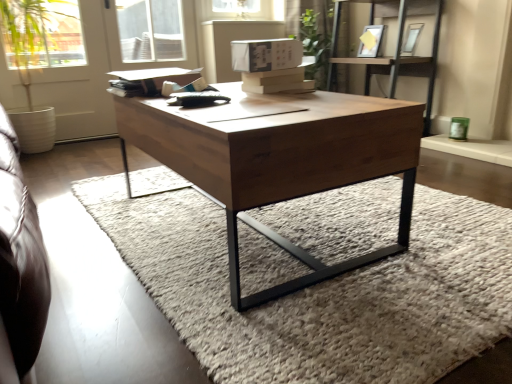
Question: From the image's perspective, is wooden shelf at upper right above matte white picture frame at upper center, arranged as the second picture frame when viewed from the right?

Choices:
 (A) no
 (B) yes

Answer: (A)

Question: Considering the relative sizes of wooden shelf at upper right and matte white picture frame at upper center, positioned as the 1th picture frame in left-to-right order, in the image provided, is wooden shelf at upper right taller than matte white picture frame at upper center, positioned as the 1th picture frame in left-to-right order,?

Choices:
 (A) no
 (B) yes

Answer: (B)

Question: From the image's perspective, is wooden shelf at upper right located beneath matte white picture frame at upper center, positioned as the 1th picture frame in left-to-right order?

Choices:
 (A) no
 (B) yes

Answer: (B)

Question: Is wooden shelf at upper right not within matte white picture frame at upper center, positioned as the 1th picture frame in left-to-right order?

Choices:
 (A) yes
 (B) no

Answer: (A)

Question: Would you say wooden shelf at upper right is a long distance from matte white picture frame at upper center, positioned as the 1th picture frame in left-to-right order?

Choices:
 (A) yes
 (B) no

Answer: (B)

Question: Could you tell me if wooden shelf at upper right is facing matte white picture frame at upper center, arranged as the second picture frame when viewed from the right?

Choices:
 (A) no
 (B) yes

Answer: (B)

Question: From a real-world perspective, is green leafy plant at upper center physically below matte silver picture frame at upper right, which is the 1th picture frame in right-to-left order?

Choices:
 (A) yes
 (B) no

Answer: (A)

Question: Is green leafy plant at upper center facing towards matte silver picture frame at upper right, arranged as the 2th picture frame when viewed from the left?

Choices:
 (A) yes
 (B) no

Answer: (B)

Question: Considering the relative positions of green leafy plant at upper center and matte silver picture frame at upper right, which is the 1th picture frame in right-to-left order, in the image provided, is green leafy plant at upper center to the right of matte silver picture frame at upper right, which is the 1th picture frame in right-to-left order, from the viewer's perspective?

Choices:
 (A) yes
 (B) no

Answer: (B)

Question: Is green leafy plant at upper center closer to the viewer compared to matte silver picture frame at upper right, arranged as the 2th picture frame when viewed from the left?

Choices:
 (A) yes
 (B) no

Answer: (B)

Question: Is green leafy plant at upper center completely or partially outside of matte silver picture frame at upper right, which is the 1th picture frame in right-to-left order?

Choices:
 (A) yes
 (B) no

Answer: (A)

Question: Can matte silver picture frame at upper right, arranged as the 2th picture frame when viewed from the left, be found inside green leafy plant at upper center?

Choices:
 (A) yes
 (B) no

Answer: (B)

Question: Does matte silver picture frame at upper right, which is the 1th picture frame in right-to-left order, touch wooden shelf at upper right?

Choices:
 (A) no
 (B) yes

Answer: (A)